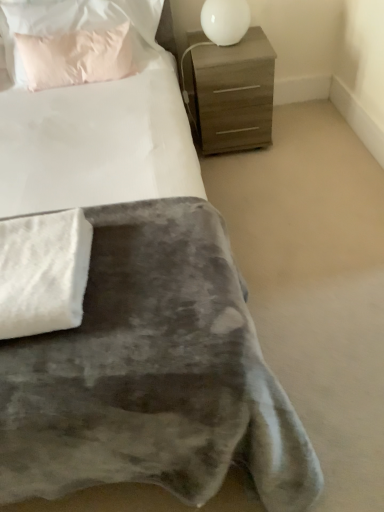
Locate an element on the screen. This screenshot has width=384, height=512. free space to the right of matte brown chest of drawers at upper right is located at coordinates (304, 135).